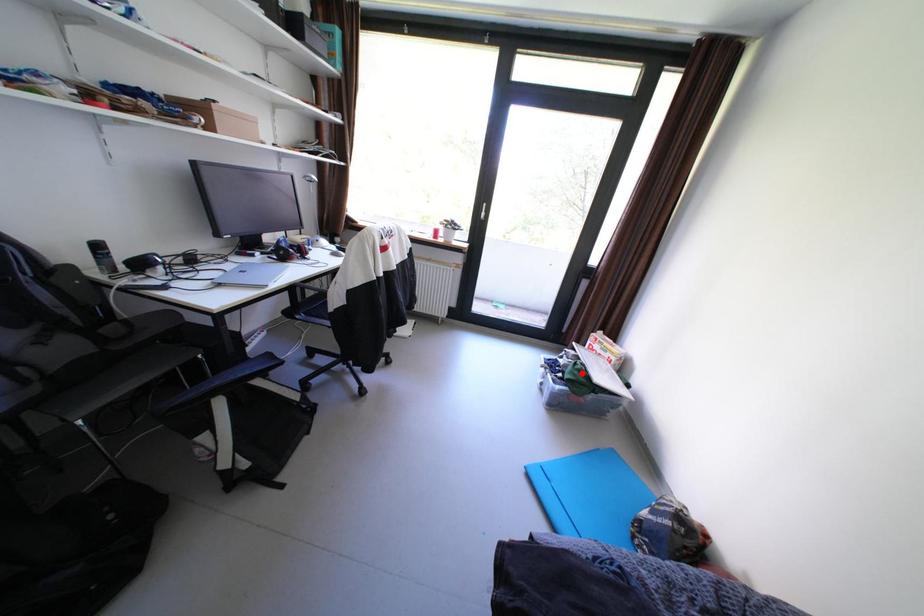
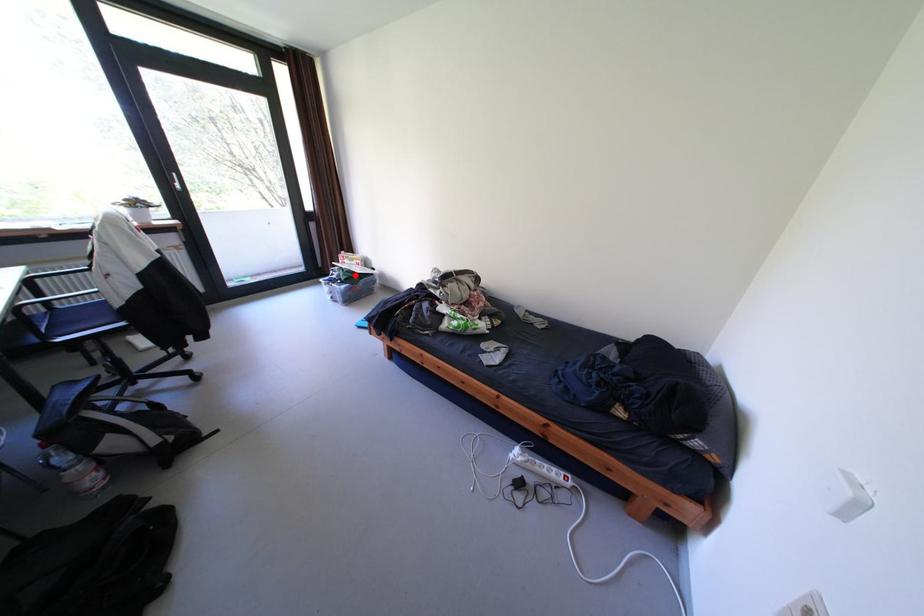
I am providing you with two images of the same scene from different viewpoints. A red point is marked on the first image and another point is marked on the second image. Do the highlighted points in image1 and image2 indicate the same real-world spot?

Yes